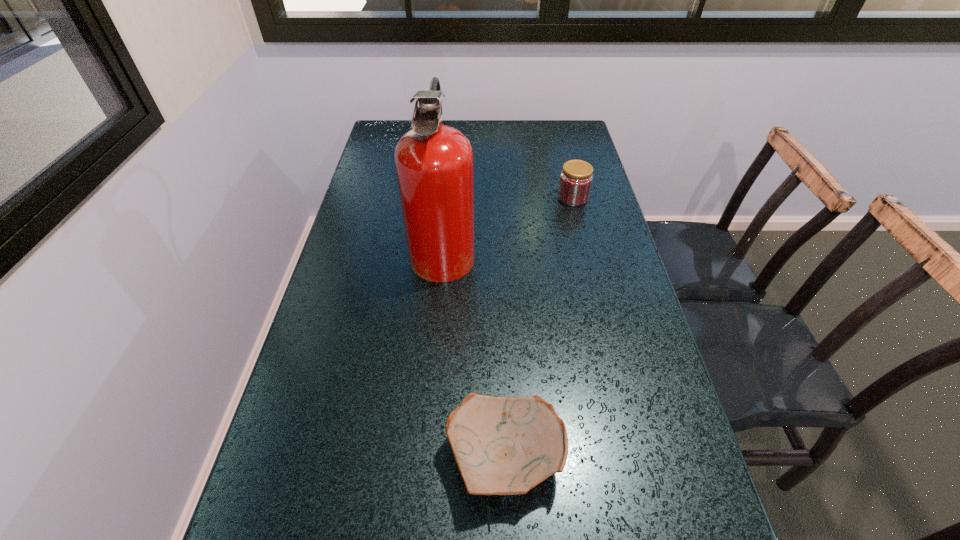
I want to click on free space at the far edge of the desktop, so click(x=526, y=132).

In the image, there is a desktop. Where is `vacant area at the right edge`? vacant area at the right edge is located at coordinates [x=643, y=380].

The image size is (960, 540). In order to click on free space between the rightmost object and the tallest object in this screenshot , I will do `click(508, 224)`.

Image resolution: width=960 pixels, height=540 pixels. I want to click on vacant region between the second farthest object and the pottery, so click(474, 353).

This screenshot has width=960, height=540. Identify the location of vacant space that is in between the pottery and the fire extinguisher. (474, 353).

Locate an element on the screen. This screenshot has width=960, height=540. unoccupied area between the farthest object and the nearest object is located at coordinates (539, 327).

I want to click on free spot between the second shortest object and the second farthest object, so click(508, 224).

The width and height of the screenshot is (960, 540). I want to click on the closest object to the nearest object, so click(434, 162).

Find the location of `the closest object to the pottery`. the closest object to the pottery is located at coordinates (434, 162).

I want to click on vacant area in the image that satisfies the following two spatial constraints: 1. on the front side of the rightmost object; 2. with the handle and nozzle on the tallest object, so click(x=586, y=249).